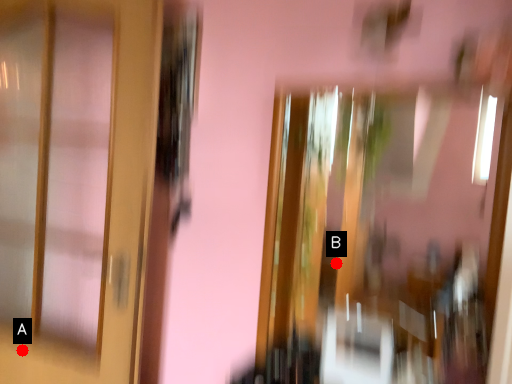
Question: Two points are circled on the image, labeled by A and B beside each circle. Which point is closer to the camera taking this photo?

Choices:
 (A) A is closer
 (B) B is closer

Answer: (A)